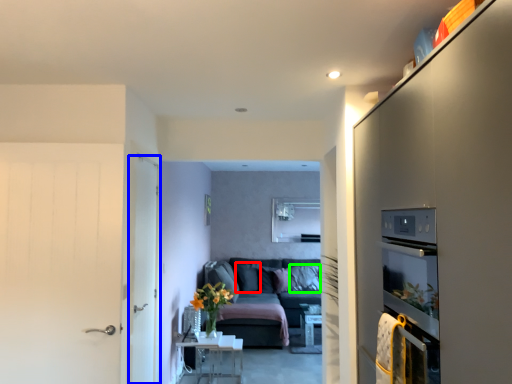
Question: Estimate the real-world distances between objects in this image. Which object is farther from pillow (highlighted by a red box), door (highlighted by a blue box) or pillow (highlighted by a green box)?

Choices:
 (A) door
 (B) pillow

Answer: (A)